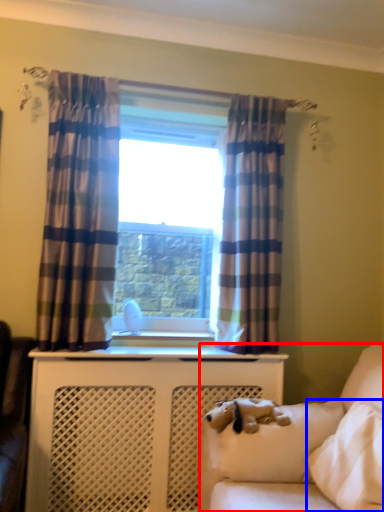
Question: Which of the following is the farthest to the observer, studio couch (highlighted by a red box) or pillow (highlighted by a blue box)?

Choices:
 (A) studio couch
 (B) pillow

Answer: (A)